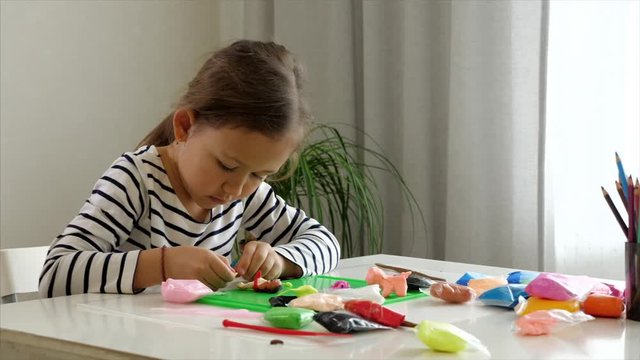
What are the coordinates of `cup of pencils` in the screenshot? It's located at (634, 265).